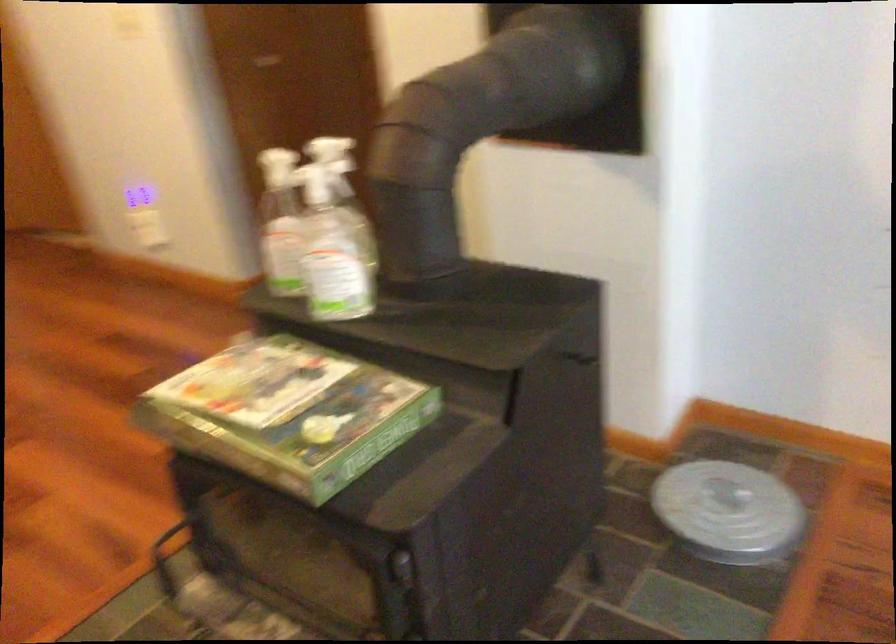
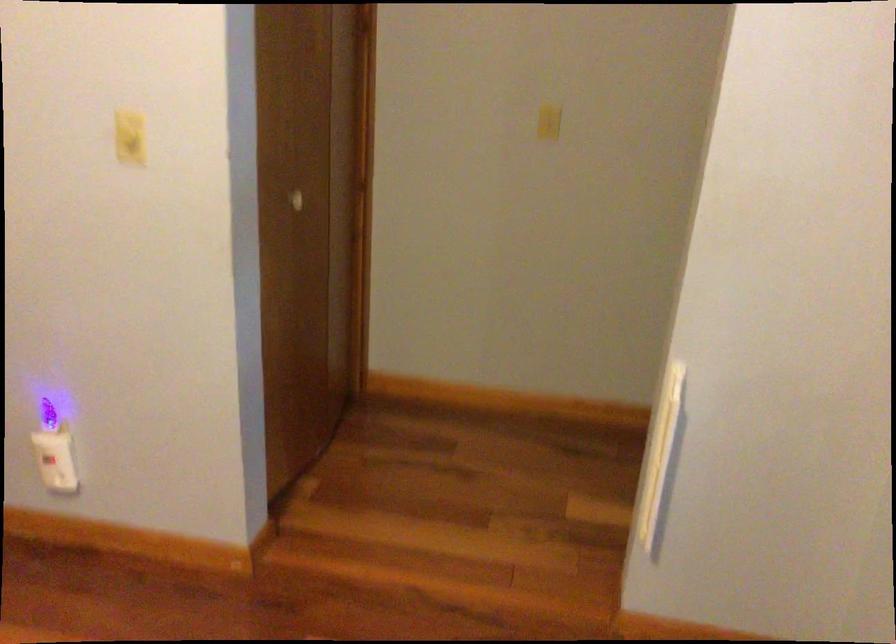
In a continuous first-person perspective shot, in which direction is the camera moving?

The cameraman walked toward left, forward.